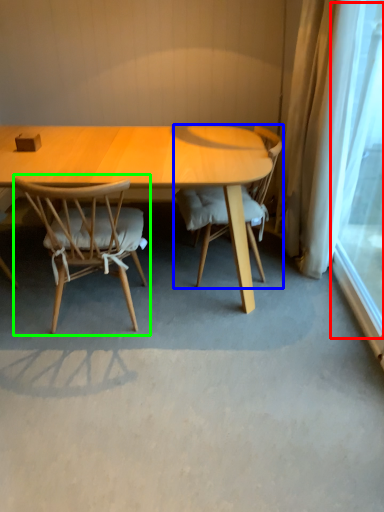
Question: Considering the real-world distances, which object is farthest from window screen (highlighted by a red box)? chair (highlighted by a blue box) or chair (highlighted by a green box)?

Choices:
 (A) chair
 (B) chair

Answer: (B)